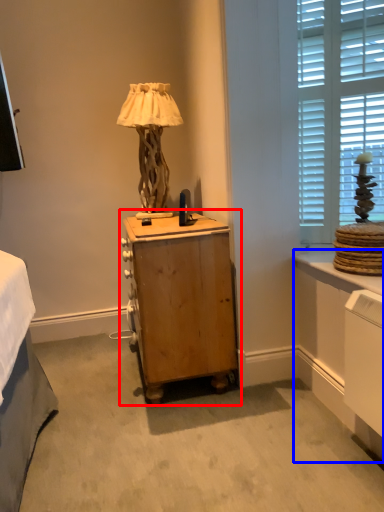
Question: Which of the following is the farthest to the observer, nightstand (highlighted by a red box) or vanity (highlighted by a blue box)?

Choices:
 (A) nightstand
 (B) vanity

Answer: (A)